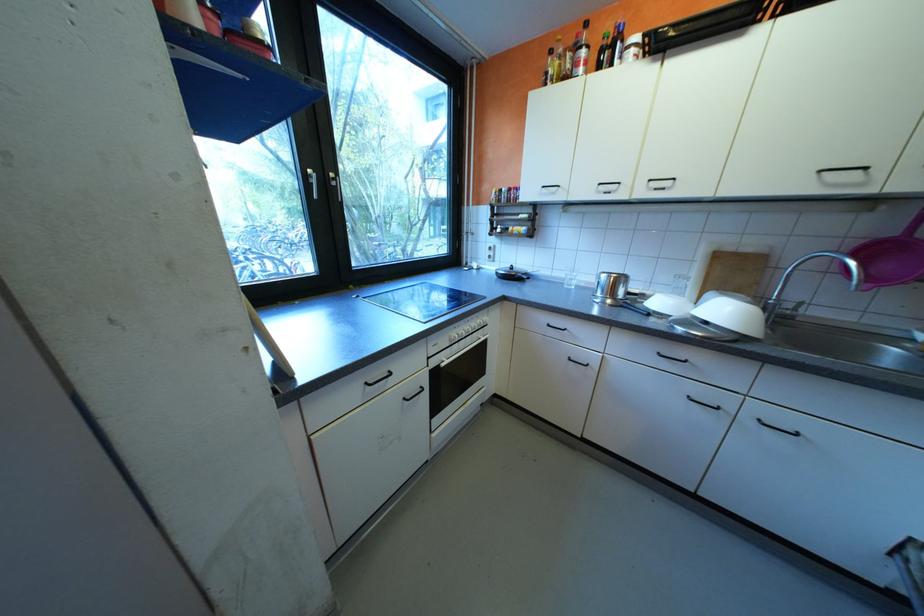
Describe the element at coordinates (789, 310) in the screenshot. I see `the faucet handle` at that location.